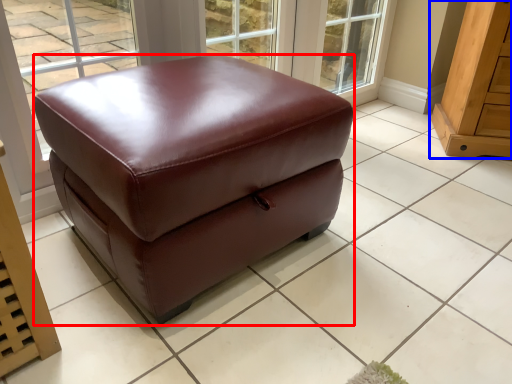
Question: Which object appears closest to the camera in this image, furniture (highlighted by a red box) or furniture (highlighted by a blue box)?

Choices:
 (A) furniture
 (B) furniture

Answer: (A)